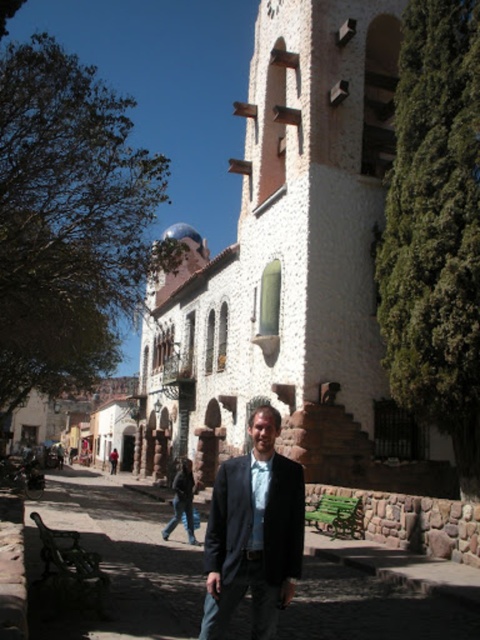
Question: Does white stucco church at center come behind blue silk tie at center?

Choices:
 (A) no
 (B) yes

Answer: (B)

Question: Which object appears closest to the camera in this image?

Choices:
 (A) matte black suit at center
 (B) blue silk tie at center
 (C) white stucco church at center

Answer: (A)

Question: Is white stucco church at center positioned before matte black suit at center?

Choices:
 (A) yes
 (B) no

Answer: (B)

Question: Can you confirm if white stucco church at center is positioned above blue silk tie at center?

Choices:
 (A) yes
 (B) no

Answer: (A)

Question: Which object is farther from the camera taking this photo?

Choices:
 (A) white stucco church at center
 (B) matte black suit at center
 (C) blue silk tie at center

Answer: (A)

Question: Estimate the real-world distances between objects in this image. Which object is closer to the blue silk tie at center?

Choices:
 (A) white stucco church at center
 (B) matte black suit at center

Answer: (B)